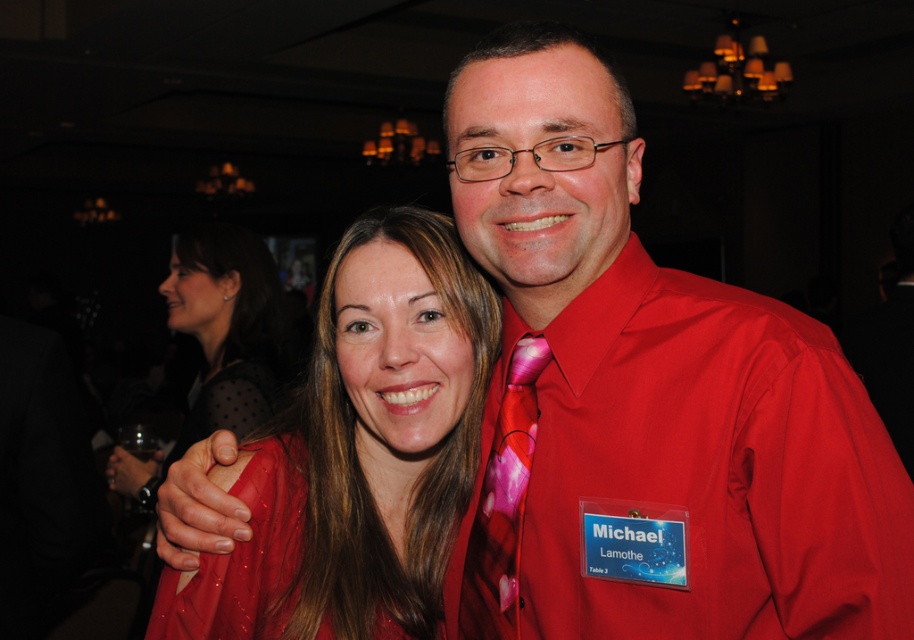
Question: Which point is farther to the camera?

Choices:
 (A) (416, 268)
 (B) (720, 388)
 (C) (195, 595)

Answer: (A)

Question: Which point is farther from the camera taking this photo?

Choices:
 (A) (240, 401)
 (B) (279, 625)
 (C) (475, 531)
 (D) (556, 625)

Answer: (A)

Question: Does satin red dress at center appear over satin black dress at center?

Choices:
 (A) no
 (B) yes

Answer: (A)

Question: In this image, where is shiny red dress at center located relative to pink floral fabric tie at upper center?

Choices:
 (A) above
 (B) below

Answer: (B)

Question: Among these points, which one is nearest to the camera?

Choices:
 (A) (808, 438)
 (B) (353, 540)
 (C) (540, 358)

Answer: (A)

Question: Does satin black dress at center appear on the right side of pink floral fabric tie at upper center?

Choices:
 (A) yes
 (B) no

Answer: (B)